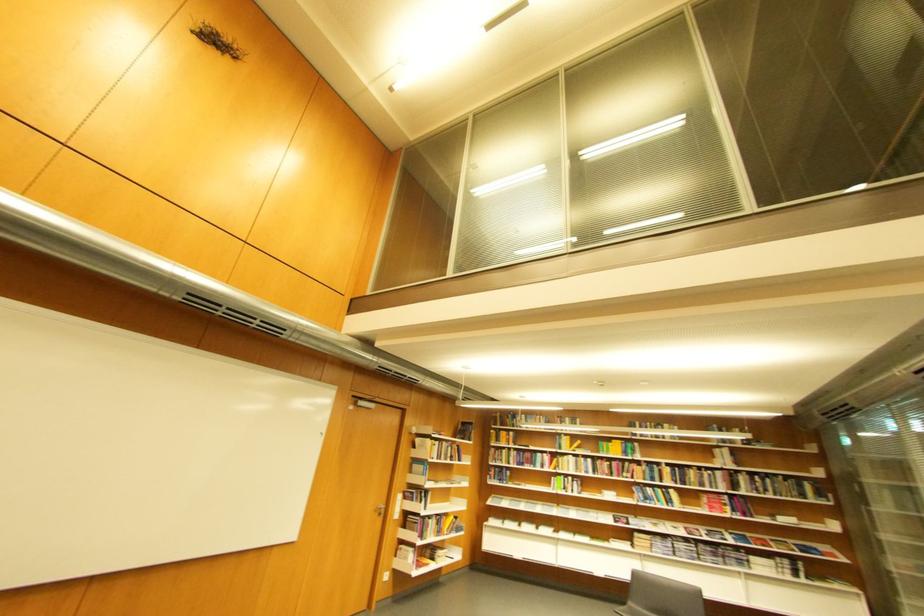
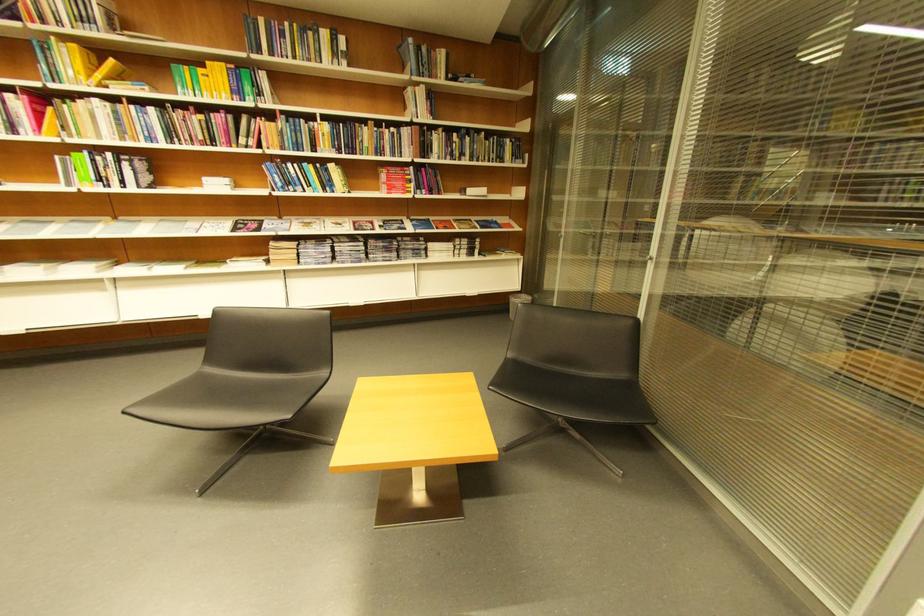
In the second image, find the point that corresponds to point 727,452 in the first image.

(419, 91)